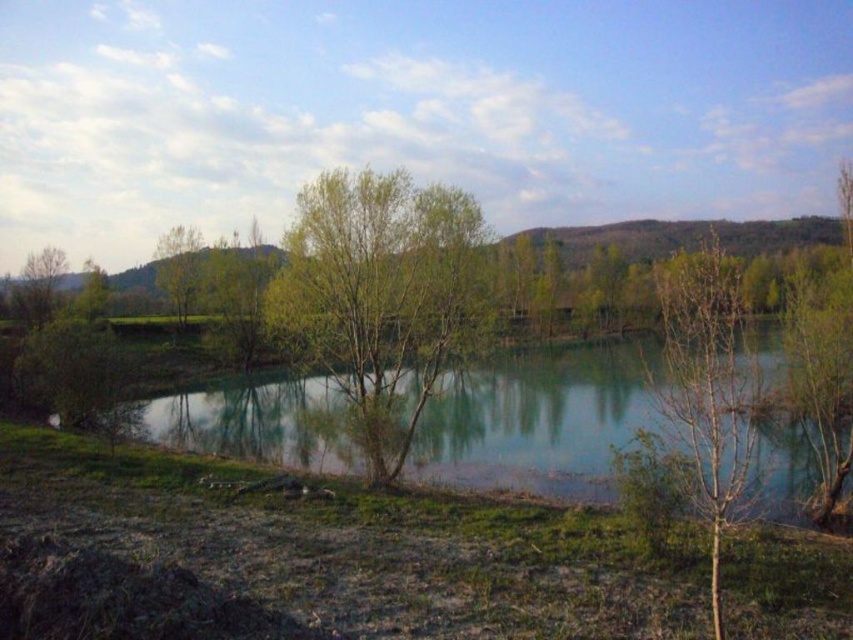
Question: Does green reflective water at center have a greater width compared to bare wood tree at center?

Choices:
 (A) no
 (B) yes

Answer: (A)

Question: Which object is farther from the camera taking this photo?

Choices:
 (A) green leafy tree at center
 (B) green matte tree at left
 (C) bare wood tree at center

Answer: (B)

Question: Considering the real-world distances, which object is farthest from the green matte tree at left?

Choices:
 (A) green leafy tree at center
 (B) green reflective water at center
 (C) green matte tree at center-left
 (D) bare wood tree at center

Answer: (D)

Question: Does green reflective water at center lie in front of green matte tree at left?

Choices:
 (A) yes
 (B) no

Answer: (A)

Question: Can you confirm if green reflective water at center is positioned to the left of green matte tree at left?

Choices:
 (A) no
 (B) yes

Answer: (A)

Question: Which object is positioned farthest from the green matte tree at left?

Choices:
 (A) green matte tree at center-left
 (B) green reflective water at center

Answer: (B)